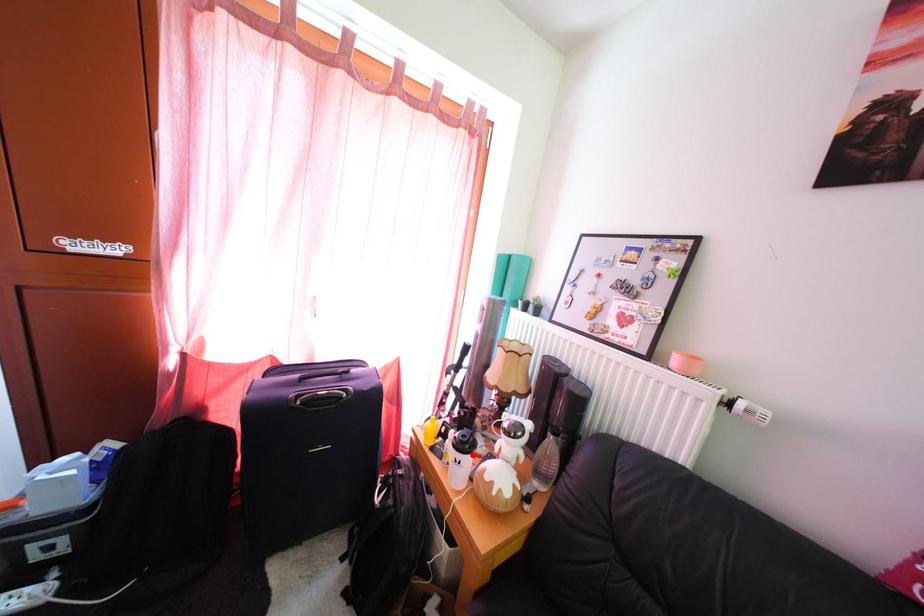
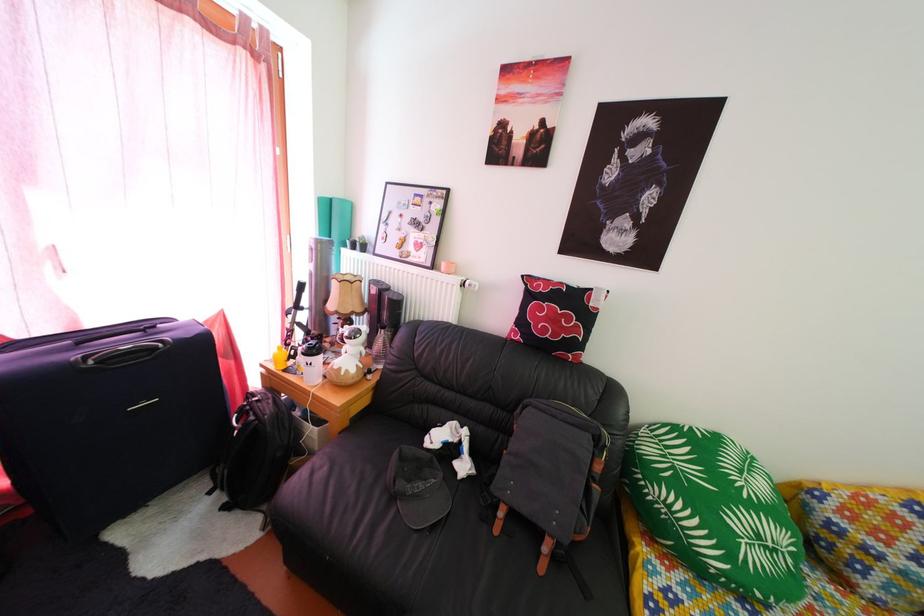
Where in the second image is the point corresponding to the highlighted location from the first image?

(321, 360)